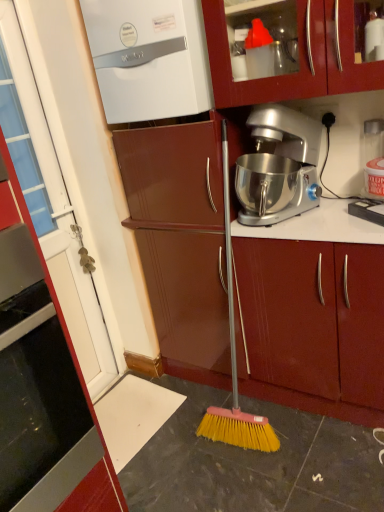
Question: From a real-world perspective, is white glossy door at left, placed as the second cabinetry when sorted from back to front, above or below white glossy boiler at upper left?

Choices:
 (A) above
 (B) below

Answer: (B)

Question: Is white glossy door at left, which is the 2th cabinetry in right-to-left order, wider or thinner than white glossy boiler at upper left?

Choices:
 (A) wide
 (B) thin

Answer: (A)

Question: Considering the real-world distances, which object is farthest from the silver metallic stand mixer at center?

Choices:
 (A) white glossy boiler at upper left
 (B) matte wood cabinet at center, the second cabinetry from the front
 (C) white glossy door at left, the first cabinetry when ordered from front to back

Answer: (C)

Question: Estimate the real-world distances between objects in this image. Which object is farther from the white glossy boiler at upper left?

Choices:
 (A) silver metallic stand mixer at center
 (B) matte wood cabinet at center, which ranks as the 2th cabinetry in left-to-right order
 (C) white glossy door at left, placed as the second cabinetry when sorted from back to front

Answer: (C)